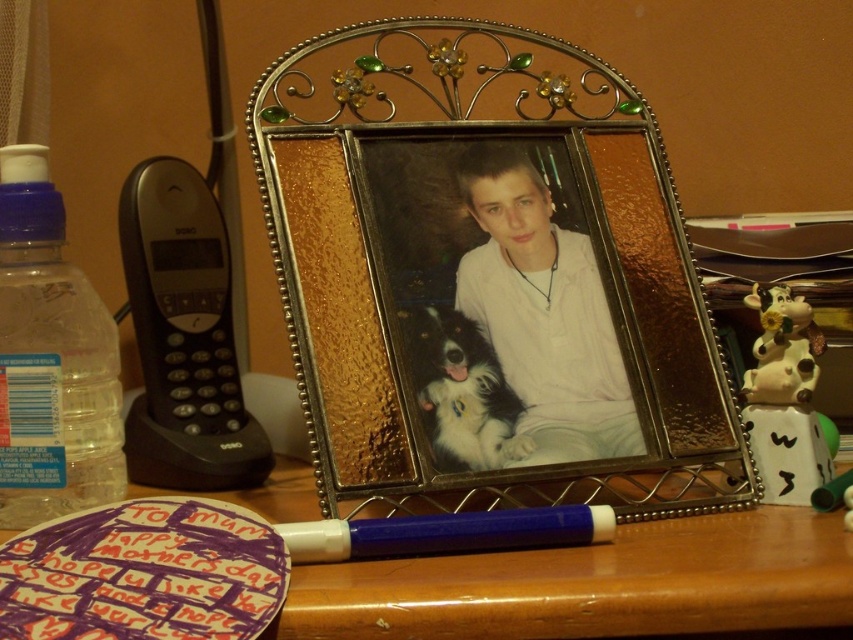
You are organizing items on a desk and need to place the white matte shirt at center and the white plastic pen at center in a drawer. The drawer has limited vertical space. Which item should you place first to ensure both fit vertically?

The white plastic pen at center should be placed first because the white matte shirt at center is taller, so placing the shorter item first allows the taller item to fit on top without exceeding the drawer height.

You are organizing items on a desk and need to place both the white matte shirt at center and the white plastic pen at center. If you want to move the pen closer to you, which object should you move it behind?

To move the white plastic pen at center closer to you, you should place it behind the white matte shirt at center since the white matte shirt at center is currently closer to the viewer than the pen.

You are organizing items on a desk and need to place a new item between the metallic gold picture frame at center and the white plastic pen at center. Based on their positions, which object should the new item be closer to?

The new item should be closer to the white plastic pen at center because the metallic gold picture frame at center is further away from the viewer, meaning the pen is closer to the viewer and thus the new item should be placed between them with the pen being nearer.